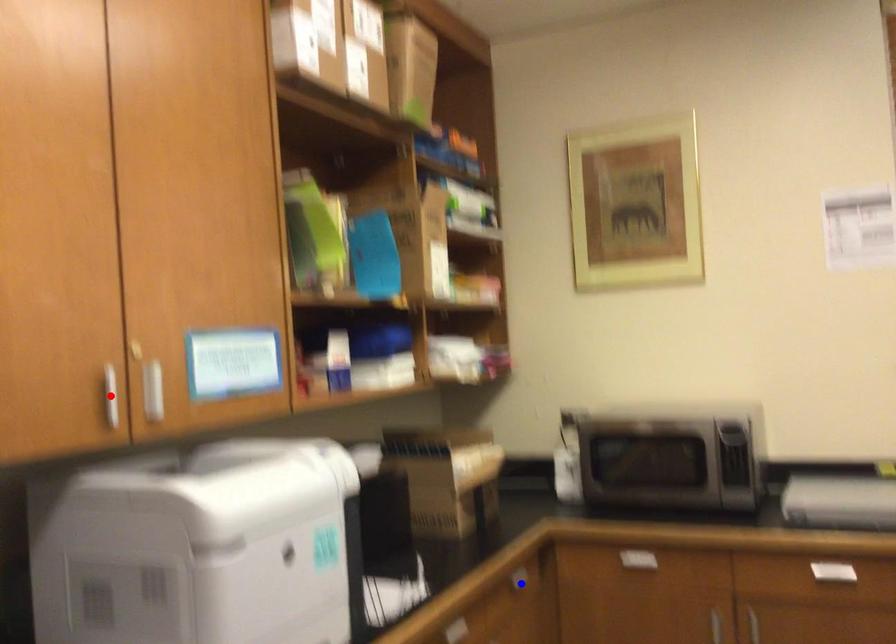
Question: In the image, two points are highlighted. Which point is nearer to the camera? Reply with the corresponding letter.

Choices:
 (A) blue point
 (B) red point

Answer: (B)